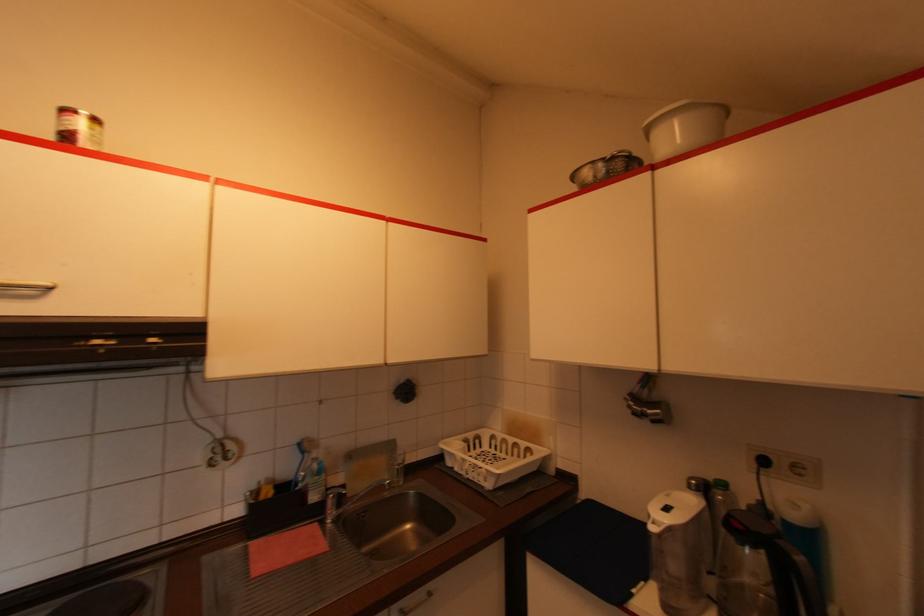
Find where to lift the black kettle handle. Please return your answer as a coordinate pair (x, y).

(804, 582)